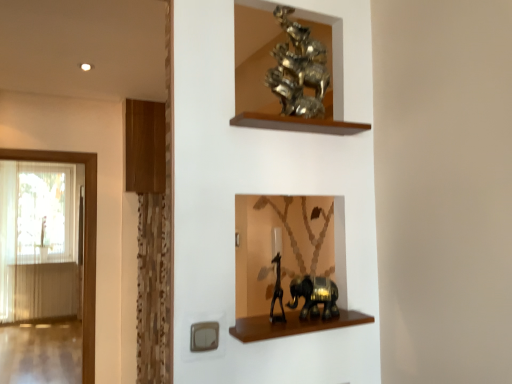
This screenshot has width=512, height=384. In order to click on empty space that is ontop of brown wooden shelf at lower center, which appears as the 1th shelf when viewed from the right (from a real-world perspective) in this screenshot , I will do `click(295, 323)`.